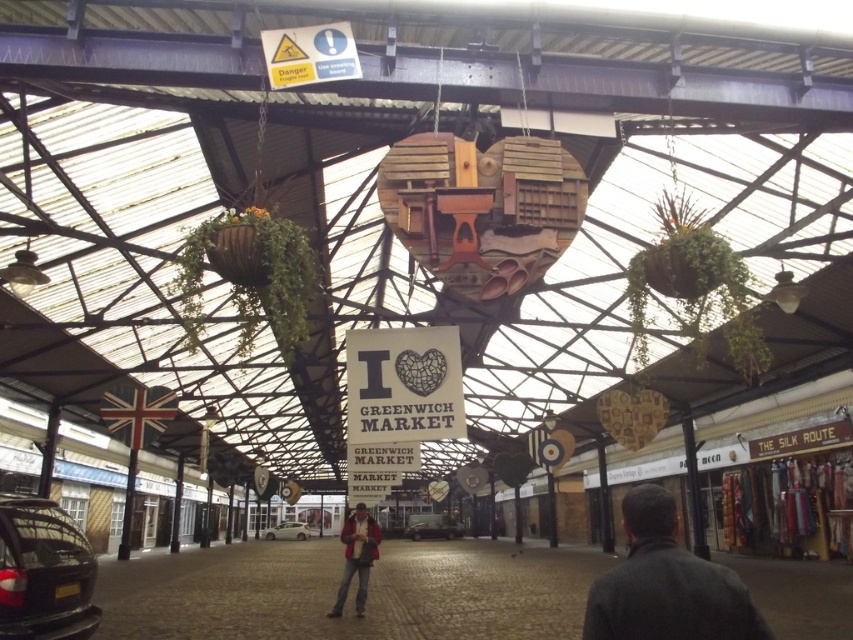
Does dark gray coat at lower right have a lesser height compared to light yellow plastic car at center?

No, dark gray coat at lower right is not shorter than light yellow plastic car at center.

Between dark gray coat at lower right and light yellow plastic car at center, which one is positioned lower?

light yellow plastic car at center is lower down.

Is point (590, 620) farther from viewer compared to point (289, 522)?

No, it is not.

Where is `dark gray coat at lower right`? dark gray coat at lower right is located at coordinates (666, 584).

How distant is shiny black car at lower left from metallic silver car at center?

shiny black car at lower left is 46.97 meters away from metallic silver car at center.

This screenshot has width=853, height=640. Find the location of `shiny black car at lower left`. shiny black car at lower left is located at coordinates (44, 572).

Is point (80, 595) closer to viewer compared to point (294, 536)?

Yes, point (80, 595) is closer to viewer.

Who is shorter, shiny black car at lower left or light yellow plastic car at center?

With less height is light yellow plastic car at center.

Locate an element on the screen. This screenshot has height=640, width=853. shiny black car at lower left is located at coordinates (44, 572).